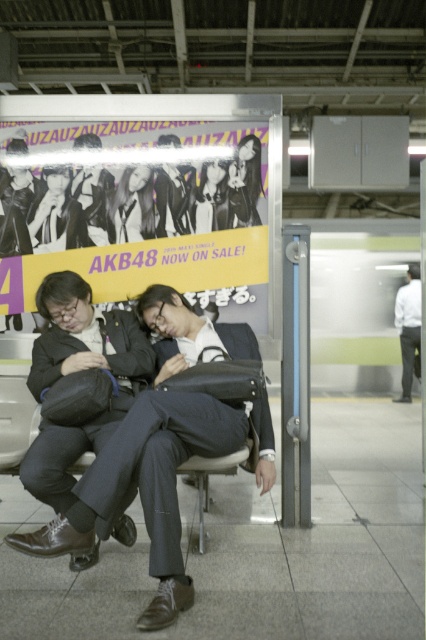
Question: Does dark gray matte suit at center appear on the left side of smooth skin face at center?

Choices:
 (A) no
 (B) yes

Answer: (B)

Question: Is smooth skin face at center closer to the viewer compared to smooth black hair at center?

Choices:
 (A) no
 (B) yes

Answer: (A)

Question: Considering the real-world distances, which object is farthest from the smooth skin face at center?

Choices:
 (A) matte black jacket at upper left
 (B) dark gray suit at center
 (C) white shirt at right
 (D) yellow paper poster at upper center

Answer: (C)

Question: Which of these objects is positioned farthest from the smooth skin face at center?

Choices:
 (A) white shirt at right
 (B) matte black jacket at upper left
 (C) smooth glossy hair at upper center
 (D) dark gray suit at center

Answer: (A)

Question: Is dark gray matte suit at center positioned at the back of white shirt at right?

Choices:
 (A) no
 (B) yes

Answer: (A)

Question: Which of the following is the closest to the observer?

Choices:
 (A) (45, 172)
 (B) (253, 205)

Answer: (A)